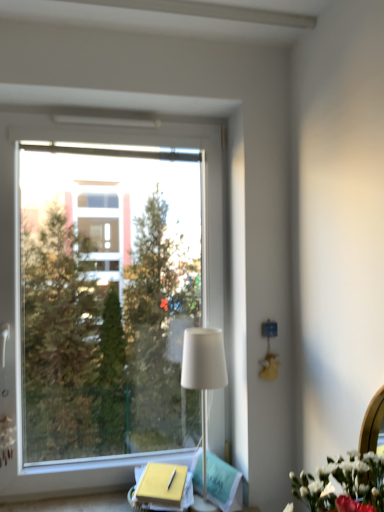
Question: Should I look upward or downward to see white fabric lampshade at center?

Choices:
 (A) down
 (B) up

Answer: (A)

Question: Is white fabric lampshade at center completely or partially inside transparent glass window at left?

Choices:
 (A) yes
 (B) no

Answer: (B)

Question: From a real-world perspective, is transparent glass window at left positioned under white fabric lampshade at center based on gravity?

Choices:
 (A) yes
 (B) no

Answer: (B)

Question: Is transparent glass window at left to the left of white fabric lampshade at center from the viewer's perspective?

Choices:
 (A) yes
 (B) no

Answer: (A)

Question: From the image's perspective, would you say transparent glass window at left is shown under white fabric lampshade at center?

Choices:
 (A) yes
 (B) no

Answer: (B)

Question: Is transparent glass window at left located outside white fabric lampshade at center?

Choices:
 (A) yes
 (B) no

Answer: (A)

Question: Is transparent glass window at left at the right side of white fabric lampshade at center?

Choices:
 (A) no
 (B) yes

Answer: (A)

Question: Is white fabric lampshade at center wider than transparent glass window at left?

Choices:
 (A) yes
 (B) no

Answer: (A)

Question: From the image's perspective, is white fabric lampshade at center beneath transparent glass window at left?

Choices:
 (A) yes
 (B) no

Answer: (A)

Question: Can you confirm if white fabric lampshade at center is positioned to the left of transparent glass window at left?

Choices:
 (A) no
 (B) yes

Answer: (A)

Question: From a real-world perspective, does white fabric lampshade at center sit lower than transparent glass window at left?

Choices:
 (A) yes
 (B) no

Answer: (A)

Question: Is white fabric lampshade at center facing away from transparent glass window at left?

Choices:
 (A) no
 (B) yes

Answer: (B)

Question: Are white fabric lampshade at center and transparent glass window at left making contact?

Choices:
 (A) yes
 (B) no

Answer: (B)

Question: Is transparent glass window at left inside or outside of white fabric lampshade at center?

Choices:
 (A) outside
 (B) inside

Answer: (A)